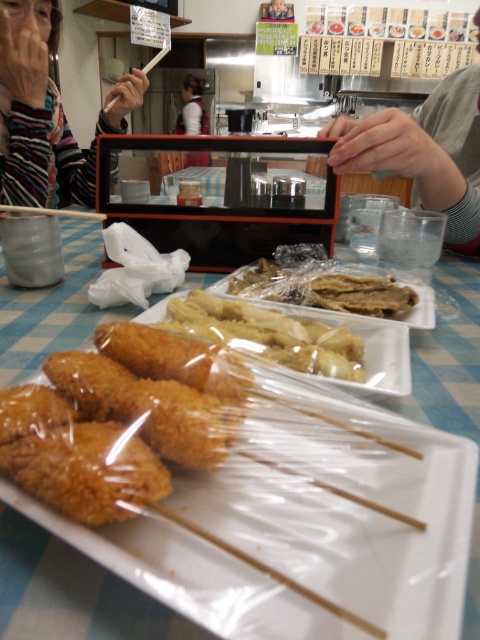
You are a customer at this Japanese restaurant and you want to reach for the golden crispy chicken at center. However, there is a smooth gray shirt at upper right in your way. Can you reach the chicken without moving the shirt?

The smooth gray shirt at upper right is taller than golden crispy chicken at center, so you would need to move the shirt to reach the chicken because it is blocking the path.

You are a server in a Japanese restaurant and need to place a 10 inch long chopsticks holder between the smooth gray shirt at upper right and the golden crispy chicken at center. Can you fit it there?

The smooth gray shirt at upper right and the golden crispy chicken at center are 9.83 inches apart from each other, so the 10 inch chopsticks holder would not fit between them.